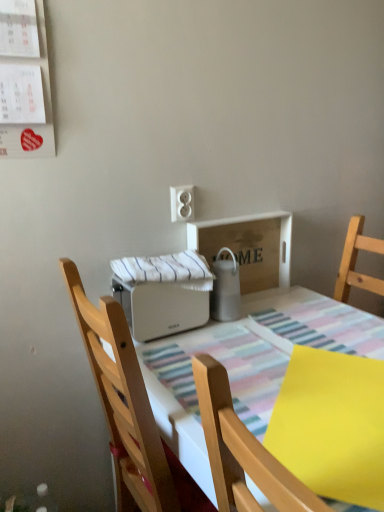
Question: Considering the relative sizes of white plastic outlet at upper center and wooden tray at center in the image provided, is white plastic outlet at upper center taller than wooden tray at center?

Choices:
 (A) yes
 (B) no

Answer: (B)

Question: From the image's perspective, is white plastic outlet at upper center located above wooden tray at center?

Choices:
 (A) yes
 (B) no

Answer: (A)

Question: Does white plastic outlet at upper center lie in front of wooden tray at center?

Choices:
 (A) yes
 (B) no

Answer: (A)

Question: From the image's perspective, is white plastic outlet at upper center located beneath wooden tray at center?

Choices:
 (A) no
 (B) yes

Answer: (A)

Question: Is white plastic outlet at upper center not near wooden tray at center?

Choices:
 (A) yes
 (B) no

Answer: (B)

Question: Can you confirm if white plastic outlet at upper center is positioned to the right of wooden tray at center?

Choices:
 (A) yes
 (B) no

Answer: (B)

Question: From a real-world perspective, is white matte toaster at center, which is counted as the 2th appliance, starting from the right, under wooden chair at center?

Choices:
 (A) no
 (B) yes

Answer: (A)

Question: Is white matte toaster at center, which is counted as the 2th appliance, starting from the right, smaller than wooden chair at center?

Choices:
 (A) no
 (B) yes

Answer: (B)

Question: Does white matte toaster at center, arranged as the first appliance when viewed from the left, have a lesser width compared to wooden chair at center?

Choices:
 (A) yes
 (B) no

Answer: (A)

Question: Is white matte toaster at center, which is counted as the 2th appliance, starting from the right, wider than wooden chair at center?

Choices:
 (A) no
 (B) yes

Answer: (A)

Question: Is white matte toaster at center, arranged as the first appliance when viewed from the left, far from wooden chair at center?

Choices:
 (A) no
 (B) yes

Answer: (A)

Question: Can you confirm if white matte toaster at center, which is counted as the 2th appliance, starting from the right, is taller than wooden chair at center?

Choices:
 (A) yes
 (B) no

Answer: (B)

Question: Considering the relative positions of white plastic toaster at center and wooden chair at center in the image provided, is white plastic toaster at center to the right of wooden chair at center from the viewer's perspective?

Choices:
 (A) no
 (B) yes

Answer: (B)